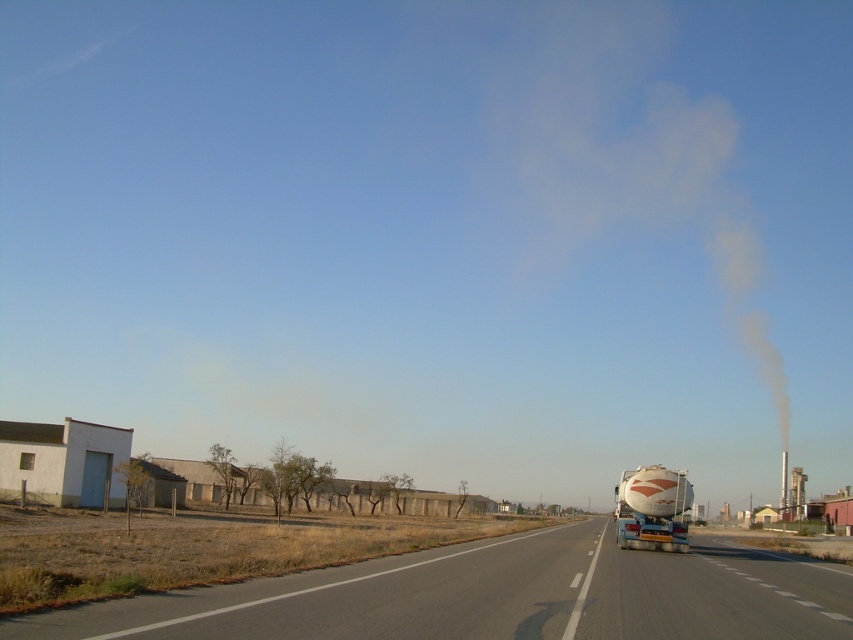
Question: Can you confirm if gray asphalt highway at center is positioned to the left of white glossy tanker at right?

Choices:
 (A) yes
 (B) no

Answer: (A)

Question: Which point is farther to the camera?

Choices:
 (A) gray asphalt highway at center
 (B) white glossy tanker at right

Answer: (B)

Question: Is gray asphalt highway at center wider than white glossy tanker at right?

Choices:
 (A) no
 (B) yes

Answer: (B)

Question: Among these objects, which one is nearest to the camera?

Choices:
 (A) white glossy tanker at right
 (B) gray asphalt highway at center

Answer: (B)

Question: Is gray asphalt highway at center thinner than white glossy tanker at right?

Choices:
 (A) no
 (B) yes

Answer: (A)